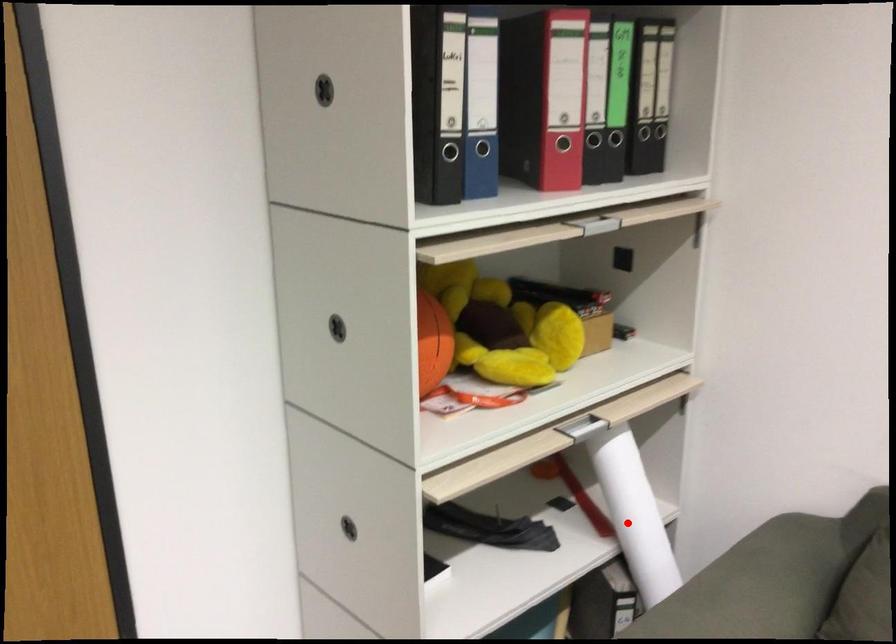
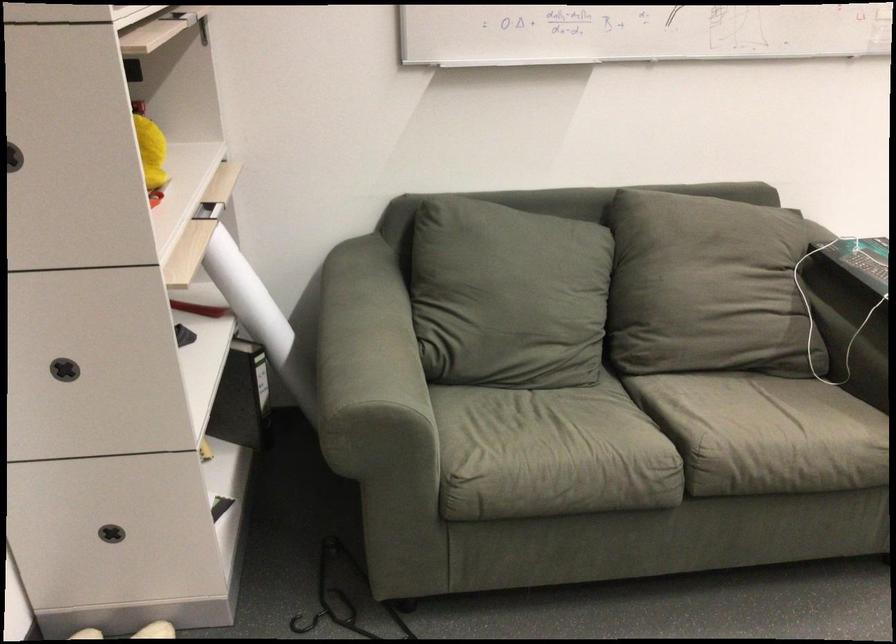
In the second image, find the point that corresponds to the highlighted location in the first image.

(247, 296)